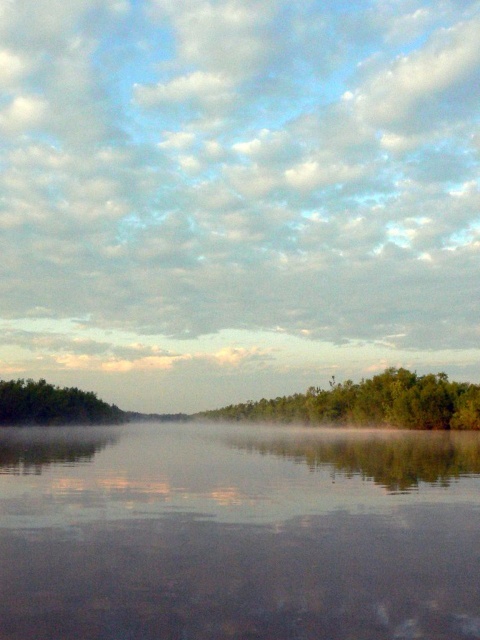
You are a drone operator trying to capture a photo of the white misty fog at center. The drone is currently at point 0.305, 0.494. Is the drone positioned correctly to take the photo?

Yes, the white misty fog at center is located at point (237, 195), so the drone is correctly positioned to take the photo.

You are standing at the center of the lake and see two points marked in the scene. Which point is closer to you, point (376,173) or point (237,636)?

Point (237,636) is closer to you because it is in front of point (376,173).

You are an environmental scientist observing the serene landscape. You notice the white misty fog at center and the smooth reflective water at center. Based on their sizes, which one might have a greater impact on the local temperature regulation of the area?

The white misty fog at center has a larger size compared to the smooth reflective water at center, so it might have a greater impact on the local temperature regulation as larger fog can trap more moisture and heat, influencing the microclimate more effectively.